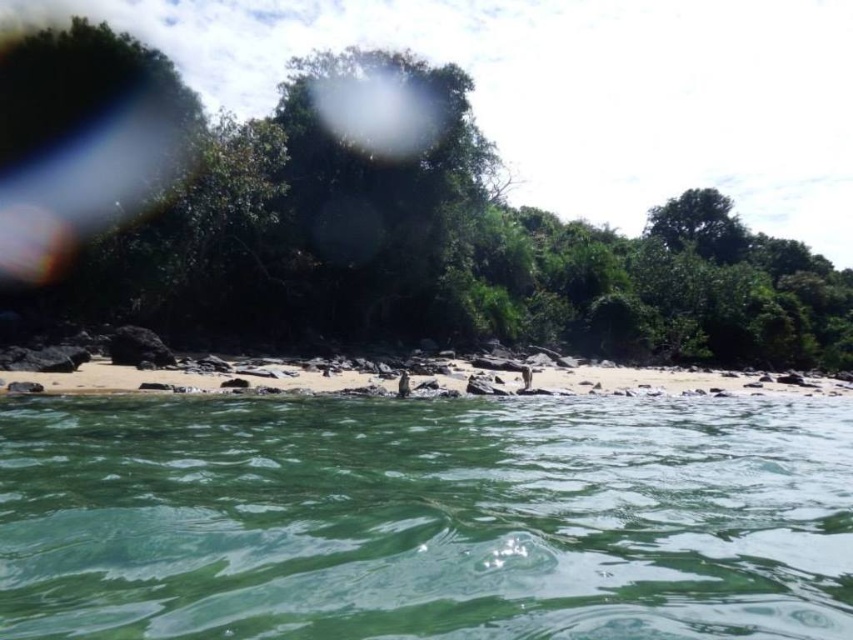
Looking at this image, does green translucent water at center have a larger size compared to white sand beach at center?

Actually, green translucent water at center might be smaller than white sand beach at center.

Is green translucent water at center smaller than white sand beach at center?

Yes, green translucent water at center is smaller than white sand beach at center.

Who is more forward, (137, 410) or (285, 388)?

Point (137, 410) is more forward.

Find the location of `green translucent water at center`. green translucent water at center is located at coordinates (424, 516).

How much distance is there between green leafy tree at center and white sand beach at center?

The distance of green leafy tree at center from white sand beach at center is 67.00 feet.

Who is more distant from viewer, [280,205] or [184,378]?

Point [280,205]

Between point (436, 116) and point (747, 394), which one is positioned behind?

The point (436, 116) is behind.

Find the location of a particular element. green leafy tree at center is located at coordinates (392, 232).

Can you confirm if green translucent water at center is positioned below green leafy tree at center?

Yes.

Which is behind, point (483, 604) or point (795, 355)?

Point (795, 355)

The width and height of the screenshot is (853, 640). Identify the location of green translucent water at center. (424, 516).